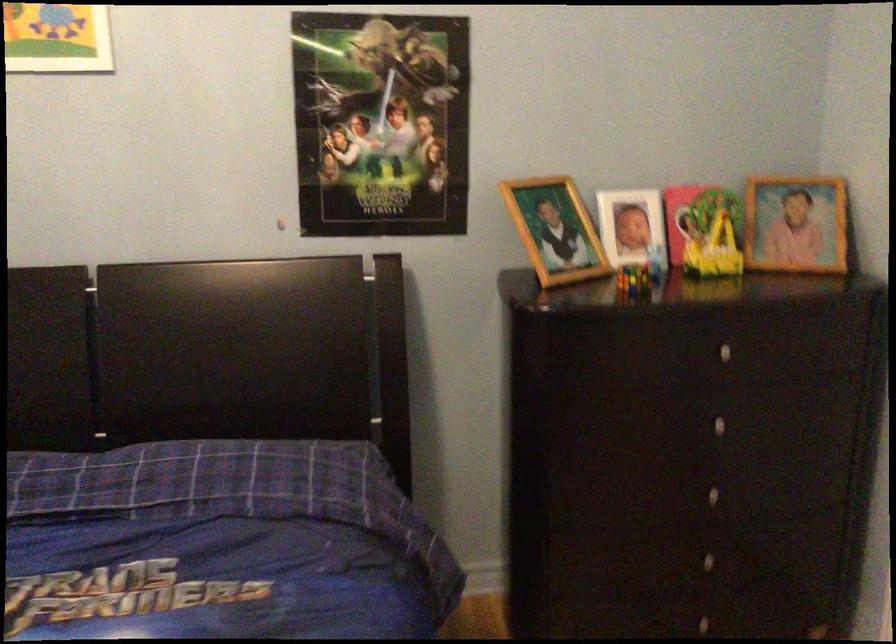
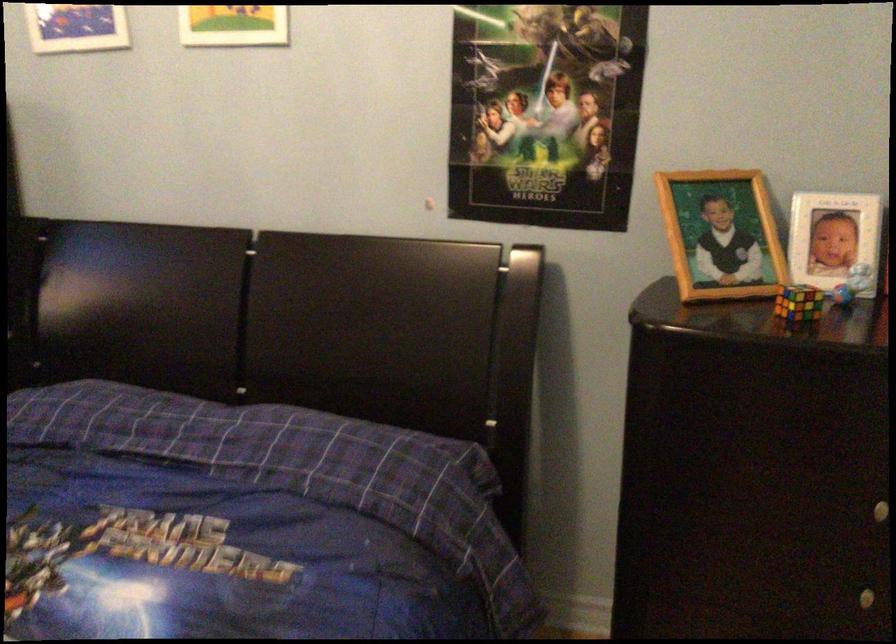
Where in the second image is the point corresponding to point 553,225 from the first image?

(720, 234)